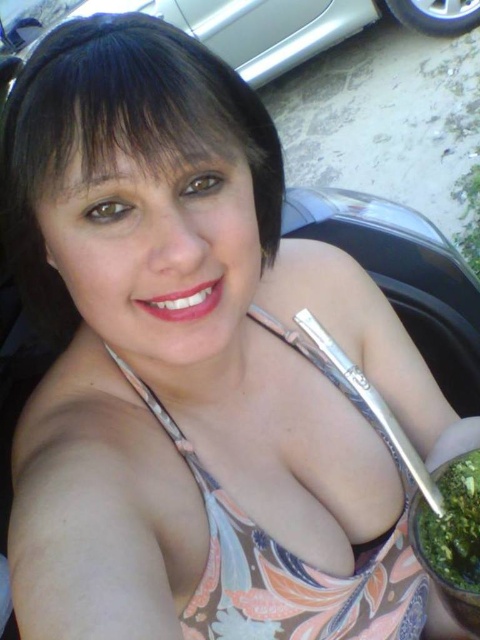
You are a photographer trying to capture the floral print bikini top at center in the image. According to the coordinates provided, where exactly should you focus your camera lens to ensure the top is centered in your shot?

To center the floral print bikini top at center in your shot, focus your camera lens at the coordinates point (291, 554).

You are a photographer trying to capture the person in the floral print bikini top at center and the silver metallic car at upper center in a single frame. Based on their sizes, which object would appear smaller in the photo?

The floral print bikini top at center would appear smaller in the photo because its width is less than the silver metallic car at upper center.

You are a photographer trying to capture a photo of the person in the floral print bikini top at center and the silver metallic car at upper center. If you want to ensure both are in focus, what should you consider about their distance?

The floral print bikini top at center is 3.60 meters from the silver metallic car at upper center. To ensure both are in focus, the photographer should use a small aperture setting to increase the depth of field, allowing objects at different distances to remain sharp.